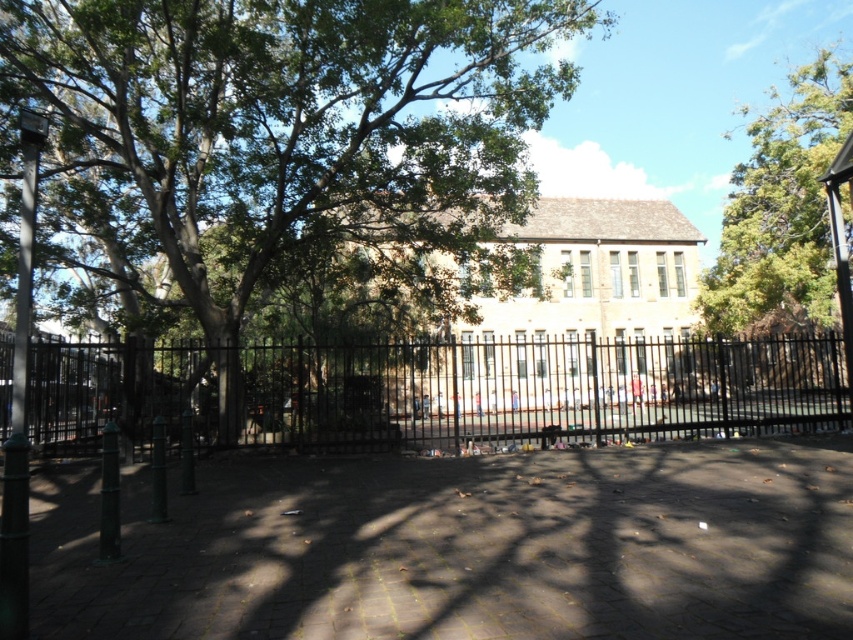
Question: Can you confirm if black metal fence at center is wider than green leafy tree at upper right?

Choices:
 (A) no
 (B) yes

Answer: (A)

Question: Is green leafy tree at center above black metal fence at center?

Choices:
 (A) yes
 (B) no

Answer: (A)

Question: Can you confirm if green leafy tree at center is positioned to the right of black metal fence at center?

Choices:
 (A) yes
 (B) no

Answer: (B)

Question: Among these objects, which one is farthest from the camera?

Choices:
 (A) green leafy tree at center
 (B) green leafy tree at upper right
 (C) black metal fence at center

Answer: (B)

Question: Among these points, which one is nearest to the camera?

Choices:
 (A) (318, 196)
 (B) (788, 244)

Answer: (A)

Question: Among these points, which one is nearest to the camera?

Choices:
 (A) (772, 429)
 (B) (721, 278)
 (C) (486, 42)

Answer: (C)